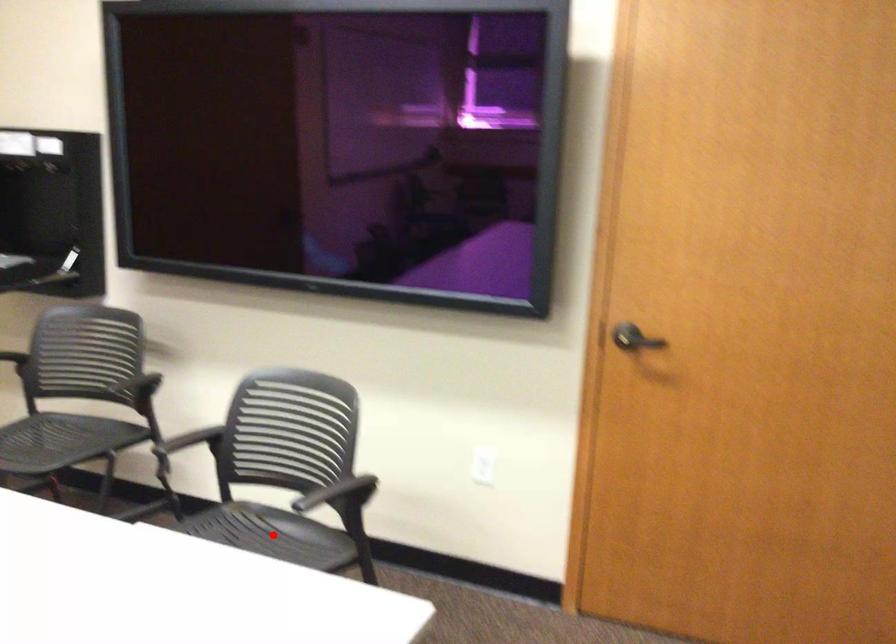
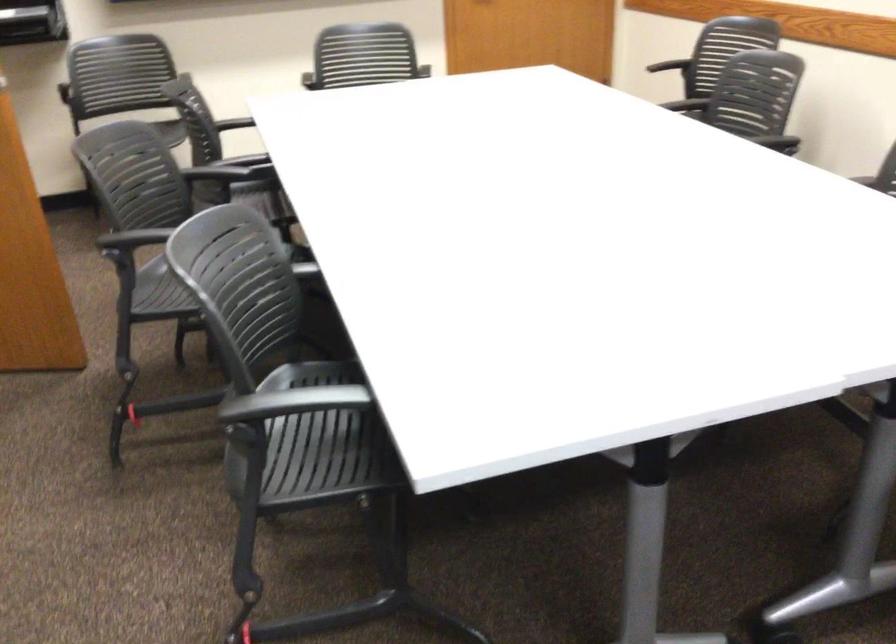
Question: I am providing you with two images of the same scene from different viewpoints. A red point is marked on the first image. At the location where the point appears in image 1, is it still visible in image 2?

Choices:
 (A) Yes
 (B) No

Answer: (B)